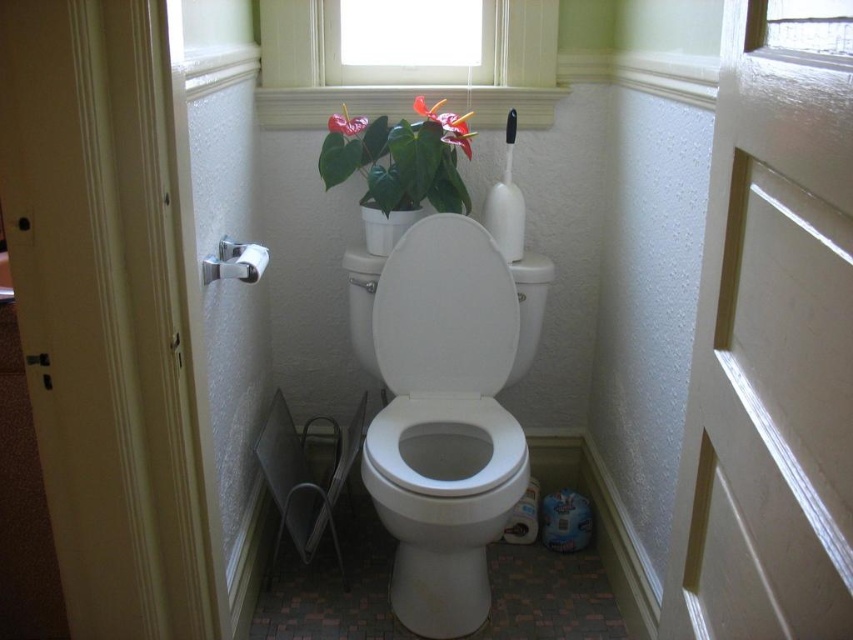
Measure the distance between white glossy toilet lid at center and camera.

1.70 meters

Locate an element on the screen. Image resolution: width=853 pixels, height=640 pixels. white glossy toilet lid at center is located at coordinates (445, 310).

Who is lower down, white glossy toilet bowl at center or white textured window at upper center?

white glossy toilet bowl at center is lower down.

Is white glossy toilet bowl at center above white textured window at upper center?

Actually, white glossy toilet bowl at center is below white textured window at upper center.

Image resolution: width=853 pixels, height=640 pixels. Identify the location of white glossy toilet bowl at center. (444, 502).

Is the position of white glossy toilet bowl at center less distant than that of white glossy toilet lid at center?

Yes.

Which is behind, point (494, 413) or point (440, 246)?

The point (494, 413) is behind.

Is point (465, 484) positioned in front of point (451, 298)?

Yes, point (465, 484) is closer to viewer.

Identify the location of white glossy toilet bowl at center. The width and height of the screenshot is (853, 640). (444, 502).